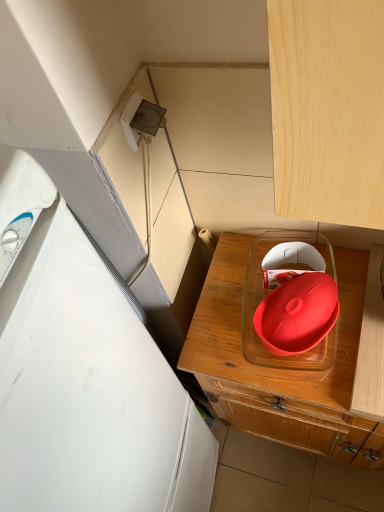
Locate an element on the screen. This screenshot has width=384, height=512. free space on the front side of rubberized red lid at center is located at coordinates 309,378.